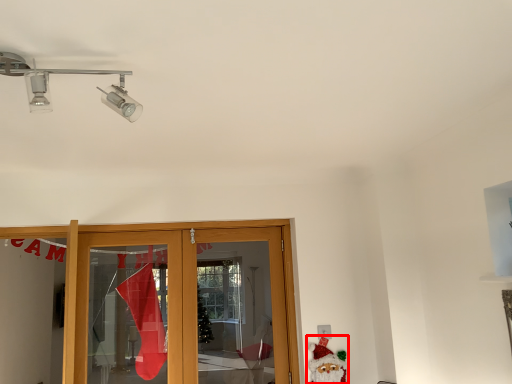
Question: Where is santa claus (annotated by the red box) located in relation to light fixture in the image?

Choices:
 (A) right
 (B) left

Answer: (A)